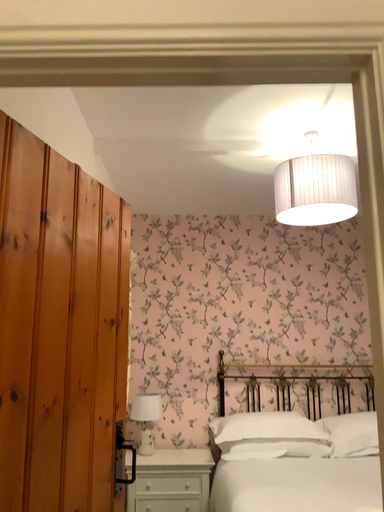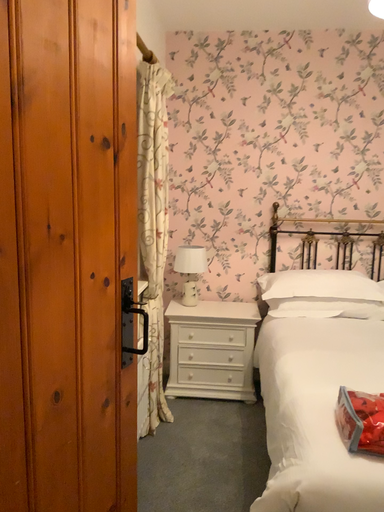
Question: Which way did the camera rotate in the video?

Choices:
 (A) rotated upward
 (B) rotated downward

Answer: (B)